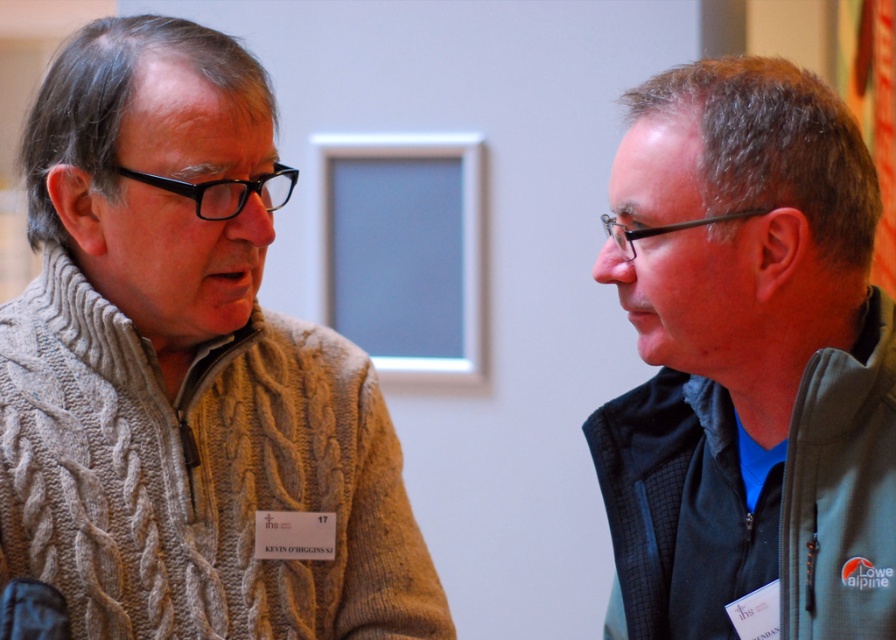
You are trying to decide which garment to wear for a casual day out. Given the image, which of the two garments, the knitted beige sweater at left or the green fleece jacket at right, has a larger width and would be more suitable for layering over a collared shirt?

The knitted beige sweater at left has a larger width than the green fleece jacket at right, making it more suitable for layering over a collared shirt.

You are a delivery robot with a 30 cm wide package. You need to place it between the knitted beige sweater at left and the green fleece jacket at right. Is there enough space for the package?

The knitted beige sweater at left and green fleece jacket at right are 40.53 centimeters apart, so yes, the 30 cm wide package can fit between them since the space is wider than the package.

You are standing in the room where the two people are talking. You want to move closer to the point at coordinates point (266, 147) without getting too close to them. The minimum safe distance you should maintain is 1 meter. Can you safely approach that point?

The distance between point (266, 147) and the viewer is 1.33 meters, which is greater than the required minimum safe distance of 1 meter. Therefore, you can safely approach the point at point (266, 147) while maintaining the required distance.